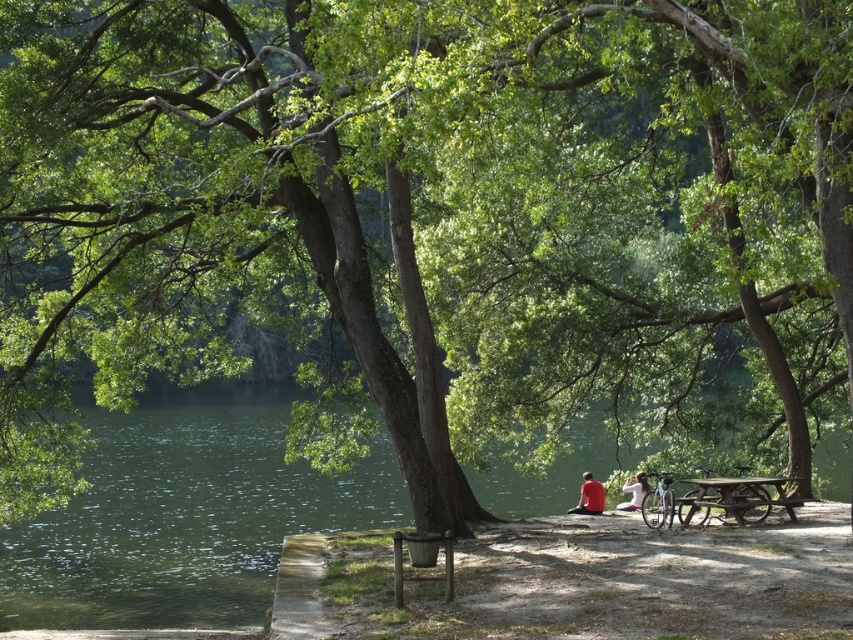
Question: Among these objects, which one is nearest to the camera?

Choices:
 (A) red matte shirt at center
 (B) matte red shirt at center
 (C) white fabric shirt at lower center

Answer: (B)

Question: Which of these objects is positioned farthest from the white fabric shirt at lower center?

Choices:
 (A) red matte shirt at center
 (B) matte red shirt at center

Answer: (B)

Question: Is the position of wooden picnic table at lower right more distant than that of red matte shirt at center?

Choices:
 (A) no
 (B) yes

Answer: (A)

Question: Does matte red shirt at center have a larger size compared to white fabric shirt at lower center?

Choices:
 (A) yes
 (B) no

Answer: (A)

Question: Which point is closer to the camera?

Choices:
 (A) matte red shirt at center
 (B) red matte shirt at center
 (C) wooden picnic table at lower right

Answer: (C)

Question: Can you confirm if wooden picnic table at lower right is positioned to the right of red matte shirt at center?

Choices:
 (A) yes
 (B) no

Answer: (A)